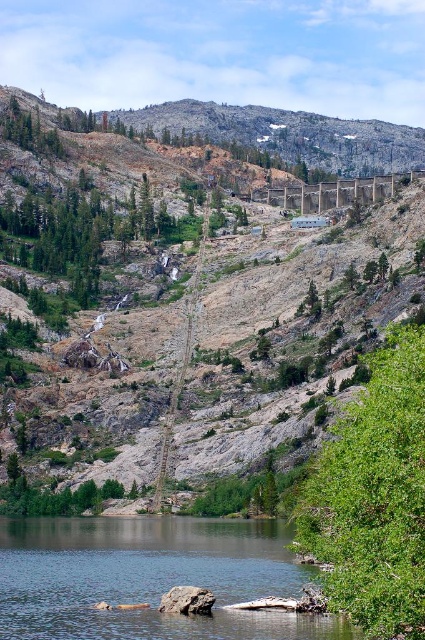
You are a hiker standing at the point labeled point (206, 589). You want to reach the cable car line that is located at point (371, 189). Given the terrain described, can you see the cable car line from your current position?

Point (371, 189) is behind point (206, 589), so the cable car line at point (371, 189) is obscured by the terrain in front of it. Therefore, you cannot see the cable car line from your current position.

You are a hiker who wants to place a 15 meter long tent between the green leafy tree at right and the gray rock at lower center. Can you fit the tent between them without overlapping either object?

The distance between the green leafy tree at right and the gray rock at lower center is 16.07 meters. Since the tent is 15 meters long, it can fit between them with 1.07 meters of space remaining.